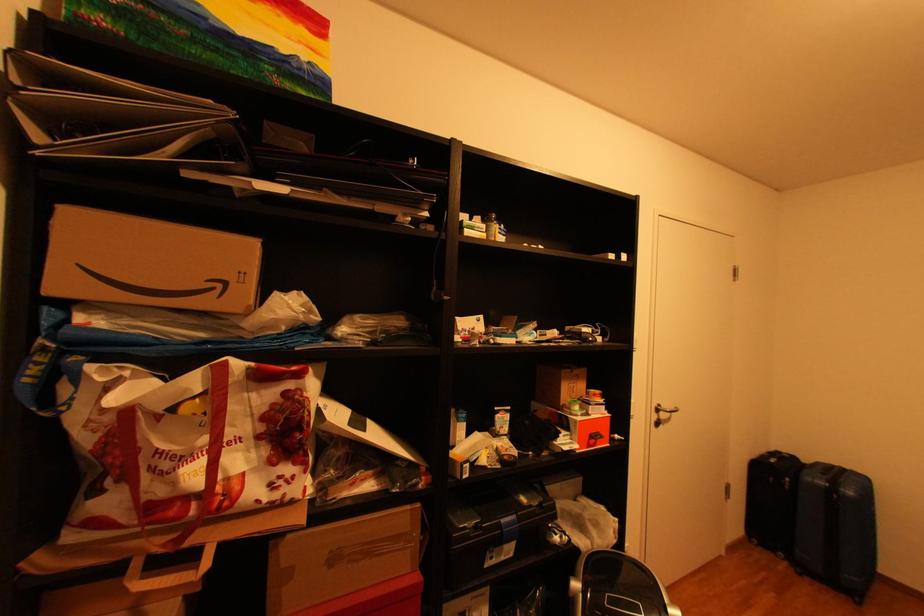
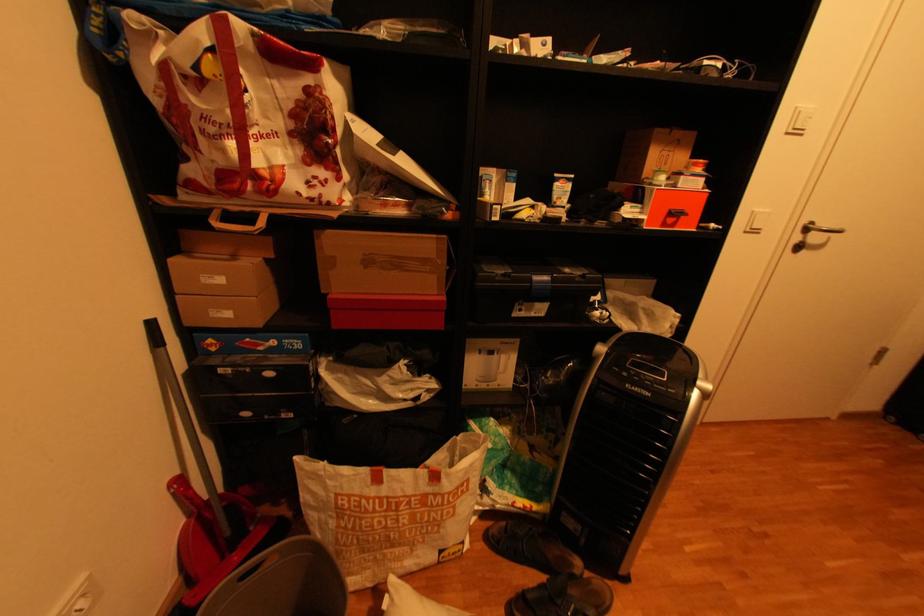
Where in the second image is the point corresponding to point (667, 411) from the first image?

(816, 230)